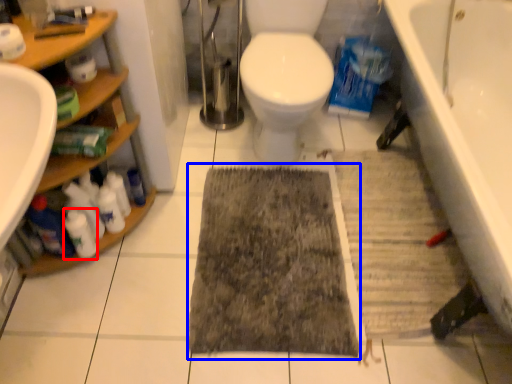
Question: Which object appears closest to the camera in this image, cleaning product (highlighted by a red box) or doormat (highlighted by a blue box)?

Choices:
 (A) cleaning product
 (B) doormat

Answer: (A)